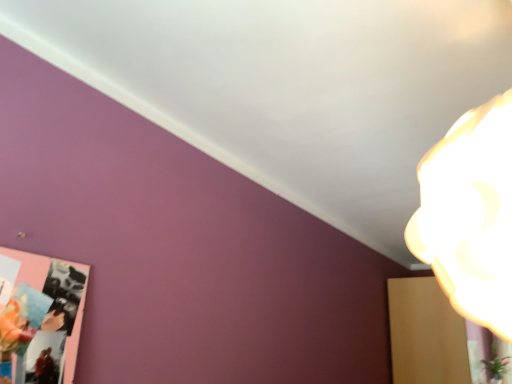
Describe the element at coordinates (470, 215) in the screenshot. I see `white glossy lampshade at upper right` at that location.

Where is `white glossy lampshade at upper right`? white glossy lampshade at upper right is located at coordinates (470, 215).

Image resolution: width=512 pixels, height=384 pixels. In order to click on white glossy lampshade at upper right in this screenshot , I will do `click(470, 215)`.